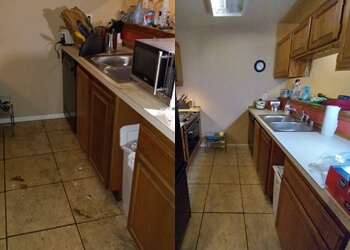
This screenshot has height=250, width=350. What are the coordinates of `tile floor` in the screenshot? It's located at (63, 244).